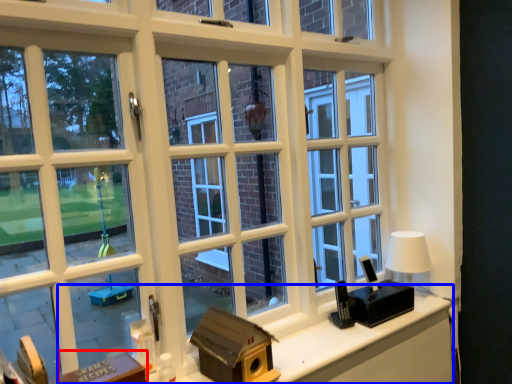
Question: Which object is closer to the camera taking this photo, table (highlighted by a red box) or computer desk (highlighted by a blue box)?

Choices:
 (A) table
 (B) computer desk

Answer: (A)